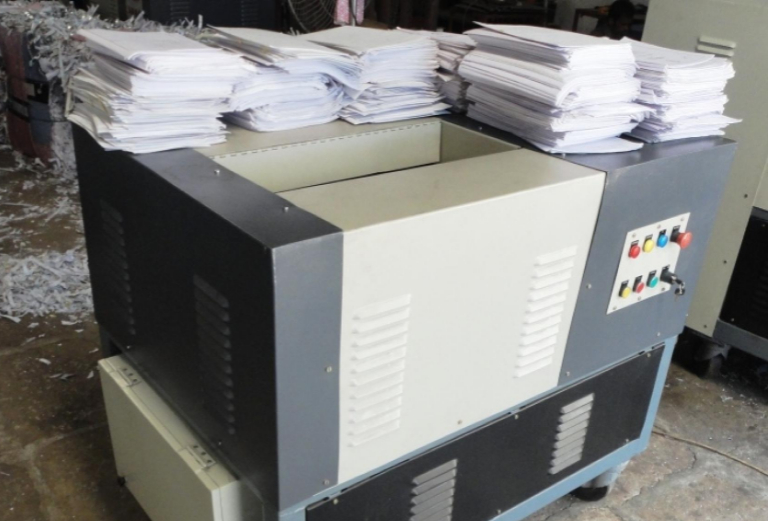
Where is `floor`? floor is located at coordinates (687, 489).